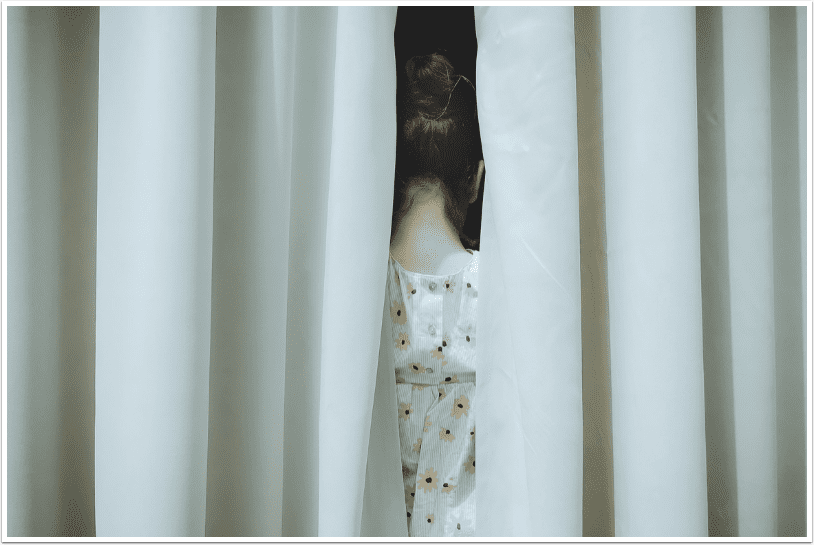
The width and height of the screenshot is (814, 545). Find the location of `curtain on right`. curtain on right is located at coordinates (548, 445).